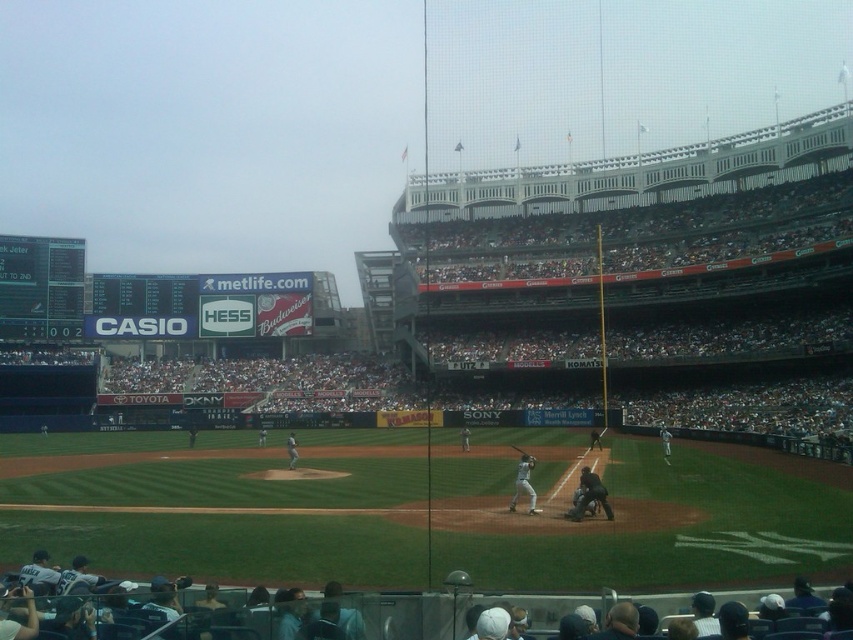
Who is more distant from viewer, (570, 515) or (523, 456)?

The point (523, 456) is behind.

Does point (585, 508) come behind point (523, 460)?

No, it is not.

Is point (604, 512) farther from camera compared to point (531, 456)?

No, it is in front of (531, 456).

Identify the location of black leather umpire at center. This screenshot has height=640, width=853. (589, 493).

Is black digital scoreboard at left smaller than white matte bat at center?

No.

Is black digital scoreboard at left above white matte bat at center?

Indeed, black digital scoreboard at left is positioned over white matte bat at center.

Is point (41, 262) positioned in front of point (521, 490)?

No, it is behind (521, 490).

The width and height of the screenshot is (853, 640). Identify the location of black digital scoreboard at left. (39, 288).

Can you confirm if white matte bat at center is positioned above metallic silver bat at center?

Actually, white matte bat at center is below metallic silver bat at center.

Is white matte bat at center positioned at the back of metallic silver bat at center?

That is False.

Between point (532, 506) and point (527, 458), which one is positioned behind?

The point (527, 458) is more distant.

Find the location of a particular element. The width and height of the screenshot is (853, 640). white matte bat at center is located at coordinates (524, 483).